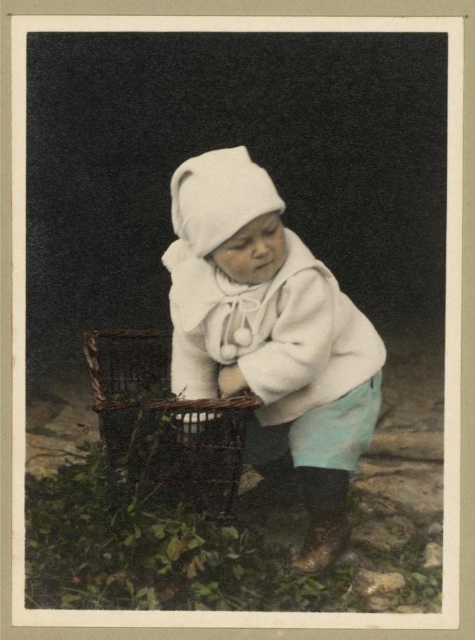
You are a photographer setting up a shoot. You need to place a small prop on top of the white soft cloth at center so that it doesn not fall off the woven brown basket at lower left. Where should you place the prop?

The white soft cloth at center is taller than the woven brown basket at lower left, so placing the prop on the center of the white soft cloth at center would ensure it stays above the basket and does not fall off.

You are a caregiver who needs to access the woven brown basket at lower left. The white soft cloth at center is covering it. Is the cloth in a position that would prevent you from reaching the basket?

The white soft cloth at center is positioned over the woven brown basket at lower left, so the cloth is covering the basket and would block access to it.

Based on the photo, you are a parent trying to place a white soft cloth at center on a woven brown basket at lower left. The basket is 21.13 centimeters away. Is the cloth within reach for a child who can stretch 20 centimeters?

The white soft cloth at center is 21.13 centimeters away from the woven brown basket at lower left. Since the child can only stretch 20 centimeters, the cloth is slightly out of reach.